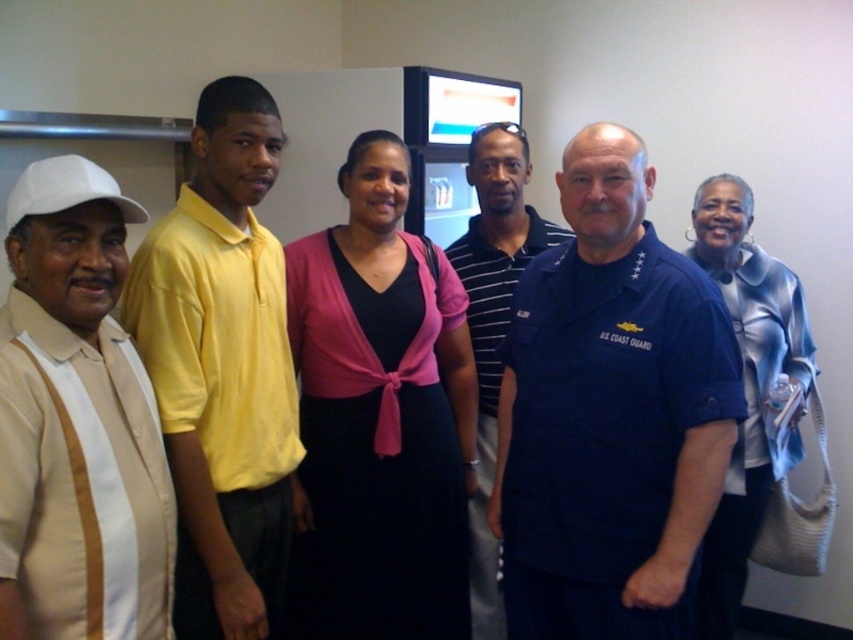
Question: Which point is closer to the camera taking this photo?

Choices:
 (A) (149, 280)
 (B) (352, 353)
 (C) (496, 192)

Answer: (A)

Question: Which of the following is the farthest from the observer?

Choices:
 (A) (459, 563)
 (B) (590, 307)
 (C) (778, 314)

Answer: (C)

Question: Is yellow cotton shirt at center to the left of blue striped polo shirt at center from the viewer's perspective?

Choices:
 (A) no
 (B) yes

Answer: (B)

Question: From the image, what is the correct spatial relationship of black satin dress at center in relation to yellow cotton shirt at center?

Choices:
 (A) below
 (B) above

Answer: (A)

Question: Does black satin dress at center appear under blue striped polo shirt at center?

Choices:
 (A) no
 (B) yes

Answer: (A)

Question: Which object is closer to the camera taking this photo?

Choices:
 (A) black satin dress at center
 (B) blue striped polo shirt at center

Answer: (A)